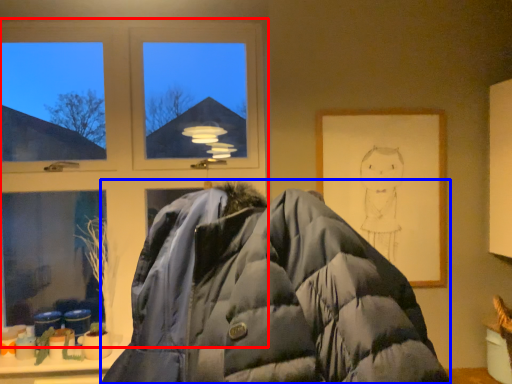
Question: Which of the following is the farthest to the observer, window (highlighted by a red box) or jacket (highlighted by a blue box)?

Choices:
 (A) window
 (B) jacket

Answer: (A)